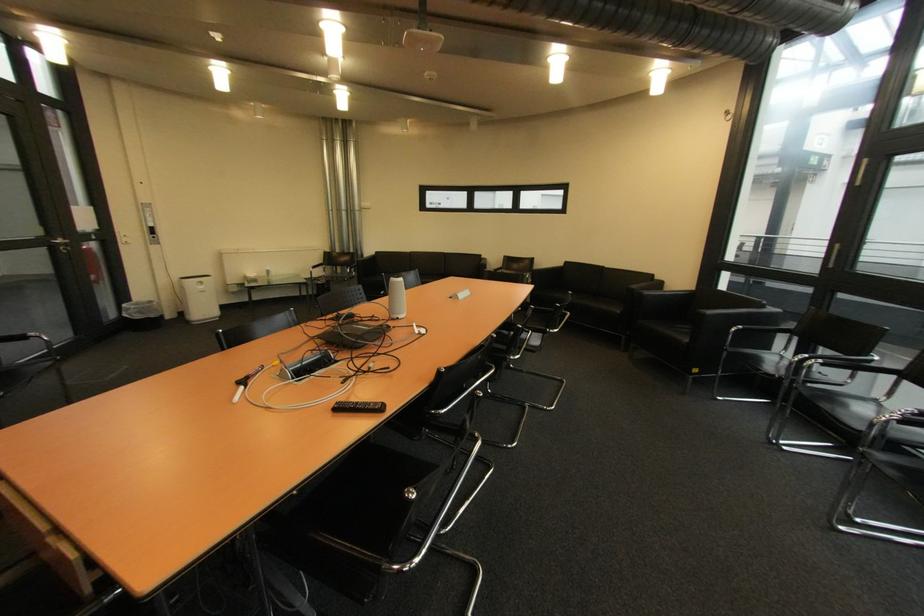
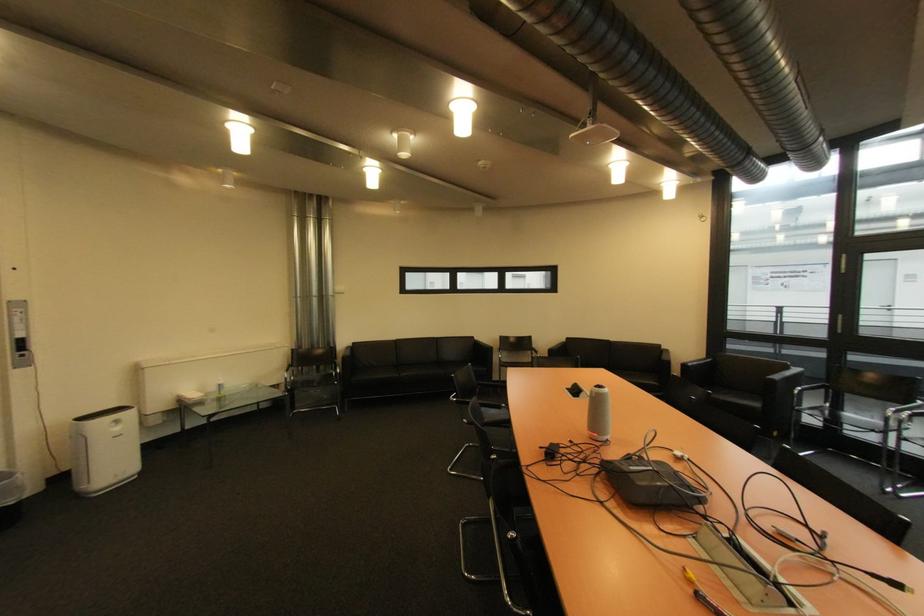
Find the pixel in the second image that matches pixel 162 238 in the first image.

(30, 357)